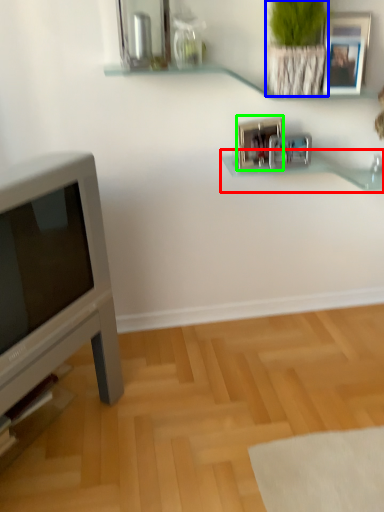
Question: Based on their relative distances, which object is farther from shelf (highlighted by a red box)? Choose from plant (highlighted by a blue box) and picture frame (highlighted by a green box).

Choices:
 (A) plant
 (B) picture frame

Answer: (A)